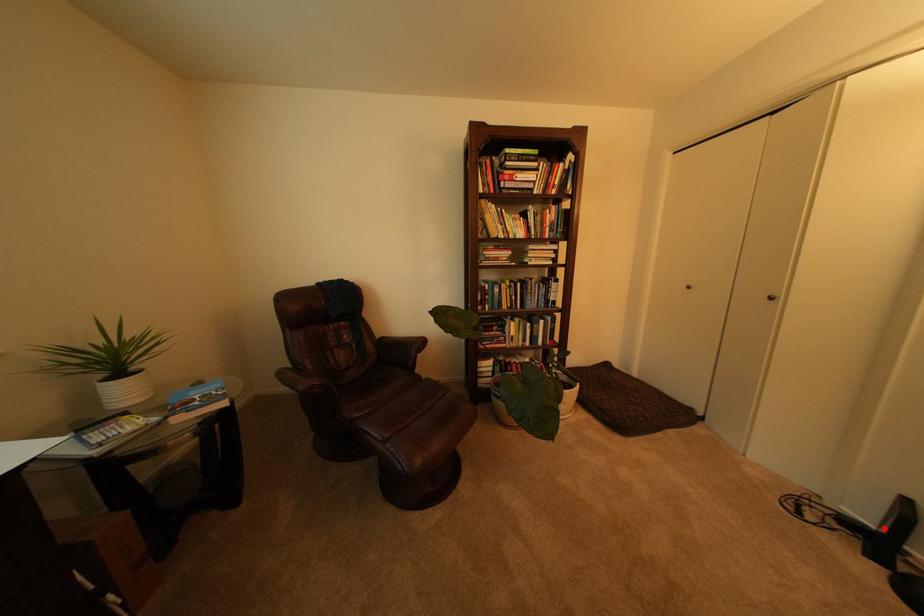
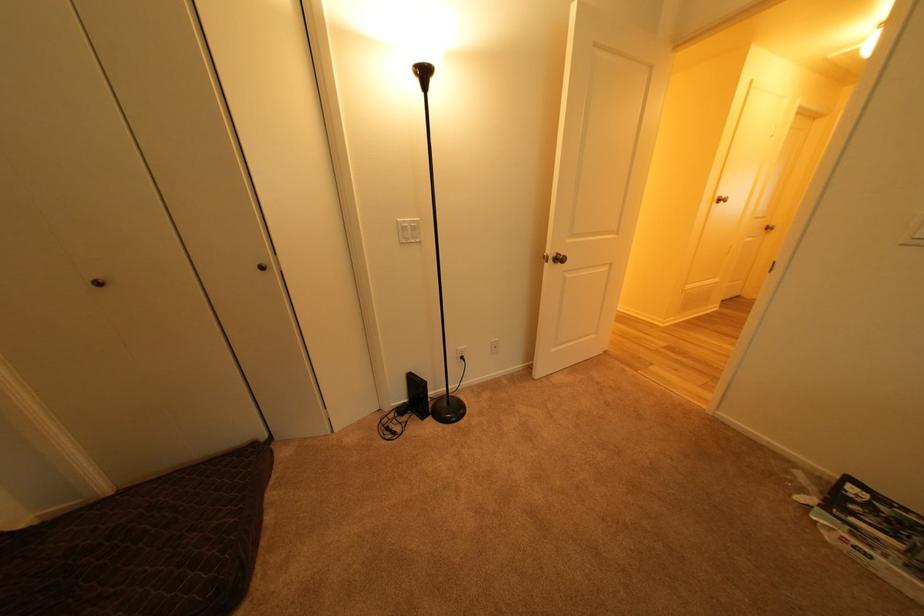
Question: I am providing you with two images of the same scene from different viewpoints. A red point is marked on the first image. Can you still see the location of the red point in image 2?

Choices:
 (A) Yes
 (B) No

Answer: (A)